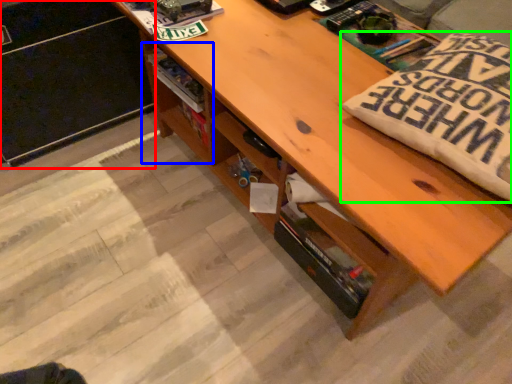
Question: Based on their relative distances, which object is farther from file cabinet (highlighted by a red box)? Choose from shelf (highlighted by a blue box) and throw pillow (highlighted by a green box).

Choices:
 (A) shelf
 (B) throw pillow

Answer: (B)